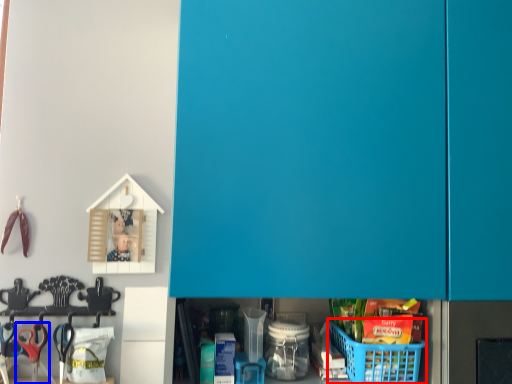
Question: Which point is closer to the camera, basket (highlighted by a red box) or scissors (highlighted by a blue box)?

Choices:
 (A) basket
 (B) scissors

Answer: (A)